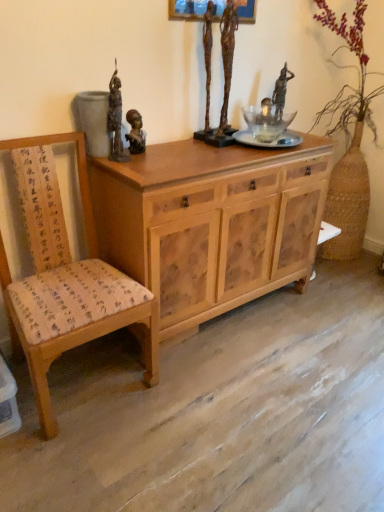
Question: In terms of height, does wooden chair with fabric cushion at left look taller or shorter compared to bronze statue at upper left, which ranks as the 2th sculpture in right-to-left order?

Choices:
 (A) tall
 (B) short

Answer: (A)

Question: Based on their positions, is wooden chair with fabric cushion at left located to the left or right of bronze statue at upper left, which ranks as the 2th sculpture in right-to-left order?

Choices:
 (A) right
 (B) left

Answer: (B)

Question: Considering the real-world distances, which object is farthest from the bronze statue at center, the first person in the left-to-right sequence?

Choices:
 (A) bronze statue at upper left, which is the first sculpture from left to right
 (B) bronze statue at center, which ranks as the 1th sculpture in right-to-left order
 (C) bronze statue at upper center, which is counted as the 3th person, starting from the left
 (D) braided straw vase at right
 (E) transparent glass vase at upper center, which is the second person in left-to-right order

Answer: (D)

Question: Which object is positioned farthest from the bronze statue at upper center, which is counted as the second person, starting from the back?

Choices:
 (A) bronze statue at center, which ranks as the 1th sculpture in right-to-left order
 (B) transparent glass vase at upper center, marked as the third person in a front-to-back arrangement
 (C) bronze statue at upper left, which is the first sculpture from left to right
 (D) bronze statue at center, which ranks as the third person in right-to-left order
 (E) wooden chair with fabric cushion at left

Answer: (E)